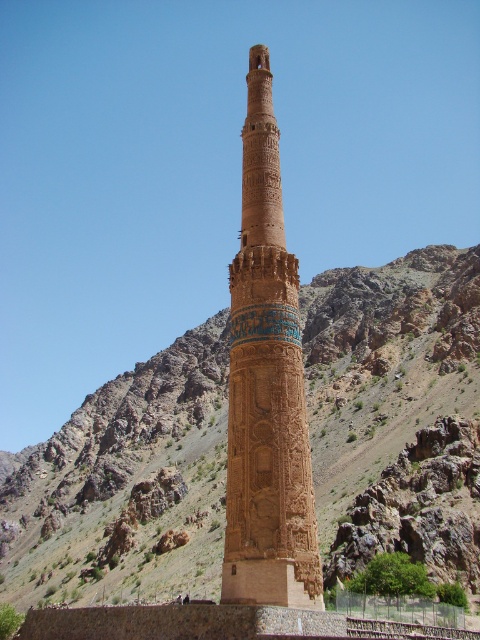
Is brown rocky mountain at center wider than brown stone minaret at center?

Yes.

Is brown rocky mountain at center smaller than brown stone minaret at center?

No, brown rocky mountain at center is not smaller than brown stone minaret at center.

At what (x,y) coordinates should I click in order to perform the action: click on brown rocky mountain at center. Please return your answer as a coordinate pair (x, y). The width and height of the screenshot is (480, 640). Looking at the image, I should click on (394, 403).